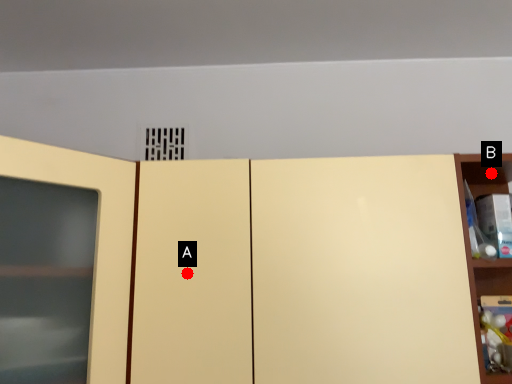
Question: Two points are circled on the image, labeled by A and B beside each circle. Which of the following is the closest to the observer?

Choices:
 (A) A is closer
 (B) B is closer

Answer: (A)